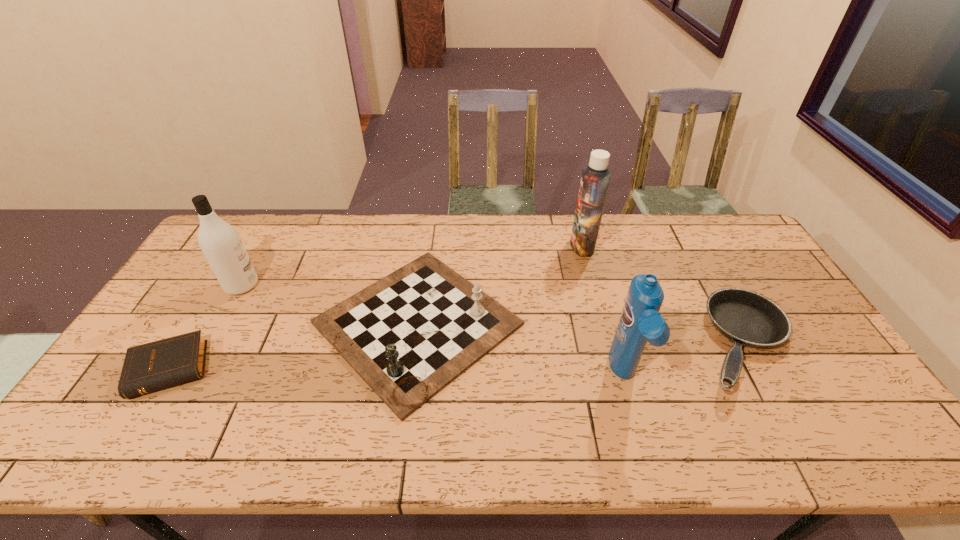
Locate an element on the screen. Image resolution: width=960 pixels, height=540 pixels. Bible that is at the left edge is located at coordinates (149, 367).

Locate an element on the screen. The image size is (960, 540). object at the right edge is located at coordinates [746, 318].

Where is `vacant space at the far edge of the desktop`? This screenshot has width=960, height=540. vacant space at the far edge of the desktop is located at coordinates (320, 235).

Locate an element on the screen. vacant space at the near edge of the desktop is located at coordinates (470, 439).

Find the location of a particular element. This screenshot has width=960, height=540. vacant space at the right edge of the desktop is located at coordinates (723, 267).

You are a GUI agent. You are given a task and a screenshot of the screen. Output one action in this format:
    pyautogui.click(x=<x>, y=<y>)
    Task: Click on the free space at the near right corner of the desktop
    This screenshot has height=540, width=960.
    Given the screenshot: What is the action you would take?
    pyautogui.click(x=884, y=456)

You are a GUI agent. You are given a task and a screenshot of the screen. Output one action in this format:
    pyautogui.click(x=<x>, y=<y>)
    Task: Click on the vacant area between the nearest shampoo and the rightmost object
    This screenshot has height=540, width=960.
    Given the screenshot: What is the action you would take?
    pyautogui.click(x=684, y=360)

This screenshot has width=960, height=540. Identify the location of free space between the frying pan and the nearest shampoo. (684, 360).

Where is `empty space that is in between the nearest shampoo and the gameboard`? empty space that is in between the nearest shampoo and the gameboard is located at coordinates (521, 350).

This screenshot has height=540, width=960. I want to click on vacant region between the leftmost shampoo and the shortest object, so click(x=207, y=327).